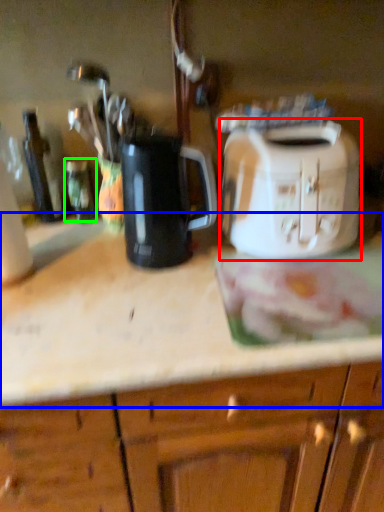
Question: Considering the real-world distances, which object is farthest from toaster (highlighted by a red box)? countertop (highlighted by a blue box) or bottle (highlighted by a green box)?

Choices:
 (A) countertop
 (B) bottle

Answer: (B)